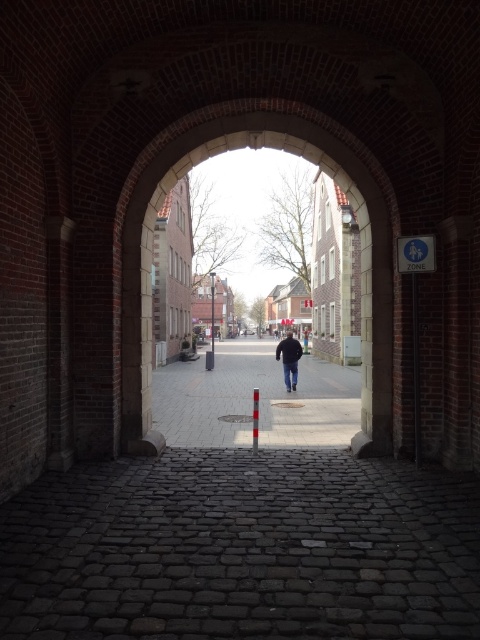
You are standing in a historical area and want to take a photo of the brick tunnel at center. Where should you position yourself to capture the entire structure in your camera frame?

The brick tunnel at center is located at point (x=360, y=262), so you should position yourself directly in front of it to ensure the entire structure fits within the camera frame.

You are standing inside the brick tunnel at center and want to walk to the smooth stone pavement at center. Which direction should you move to reach the pavement?

Since the brick tunnel at center is much taller than the smooth stone pavement at center, you should move downward towards the smooth stone pavement at center to reach it.